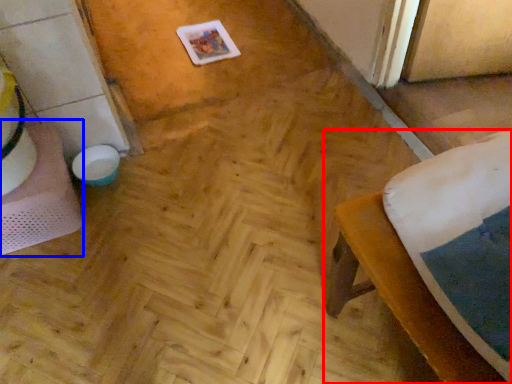
Question: Which point is further to the camera, furniture (highlighted by a red box) or table (highlighted by a blue box)?

Choices:
 (A) furniture
 (B) table

Answer: (B)